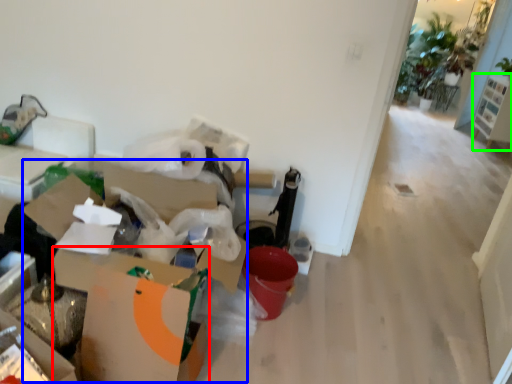
Question: Estimate the real-world distances between objects in this image. Which object is closer to cardboard box (highlighted by a red box), cardboard box (highlighted by a blue box) or furniture (highlighted by a green box)?

Choices:
 (A) cardboard box
 (B) furniture

Answer: (A)